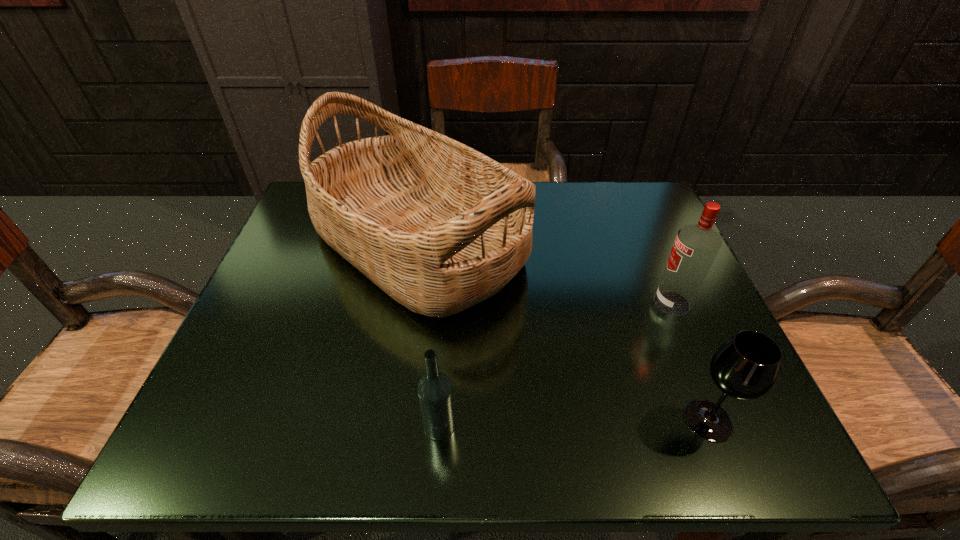
The height and width of the screenshot is (540, 960). I want to click on free spot at the far edge of the desktop, so click(560, 212).

Locate an element on the screen. vacant space at the near edge is located at coordinates (380, 416).

Locate an element on the screen. vacant space at the left edge of the desktop is located at coordinates (282, 382).

The image size is (960, 540). I want to click on free region at the right edge of the desktop, so click(622, 288).

Find the location of a particular element. This screenshot has width=960, height=540. vacant position at the far left corner of the desktop is located at coordinates (302, 205).

Where is `free space at the near left corner of the desktop`? The image size is (960, 540). free space at the near left corner of the desktop is located at coordinates click(204, 407).

You are a GUI agent. You are given a task and a screenshot of the screen. Output one action in this format:
    pyautogui.click(x=<x>, y=<y>)
    Task: Click on the free space at the far right corner
    Image resolution: width=960 pixels, height=540 pixels.
    Given the screenshot: What is the action you would take?
    pyautogui.click(x=643, y=219)

Locate an element on the screen. vacant area that lies between the taller vodka and the nearer vodka is located at coordinates (556, 364).

Where is `free space between the wineglass and the right vodka`? The width and height of the screenshot is (960, 540). free space between the wineglass and the right vodka is located at coordinates (689, 361).

Locate an element on the screen. The height and width of the screenshot is (540, 960). blank region between the right vodka and the left vodka is located at coordinates (556, 364).